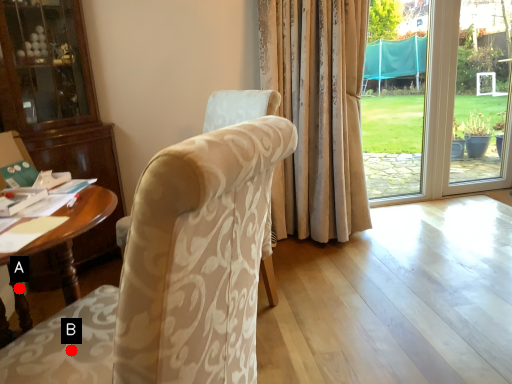
Question: Two points are circled on the image, labeled by A and B beside each circle. Among these points, which one is nearest to the camera?

Choices:
 (A) A is closer
 (B) B is closer

Answer: (B)